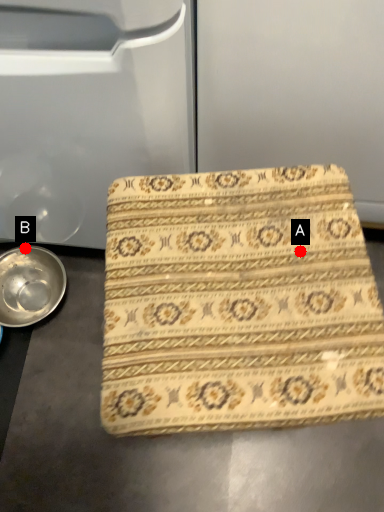
Question: Two points are circled on the image, labeled by A and B beside each circle. Which point is closer to the camera?

Choices:
 (A) A is closer
 (B) B is closer

Answer: (A)